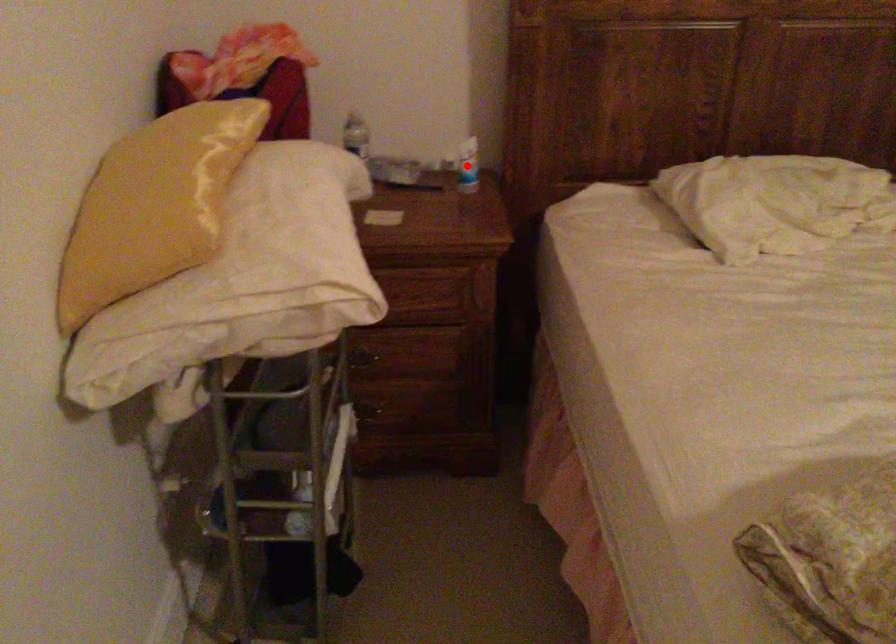
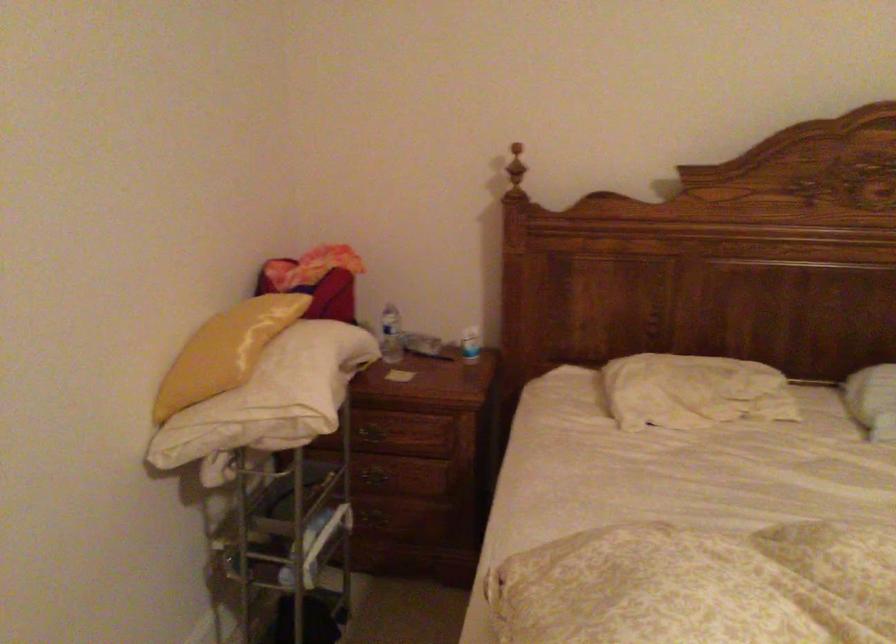
Locate, in the second image, the point that corresponds to the highlighted location in the first image.

(470, 344)